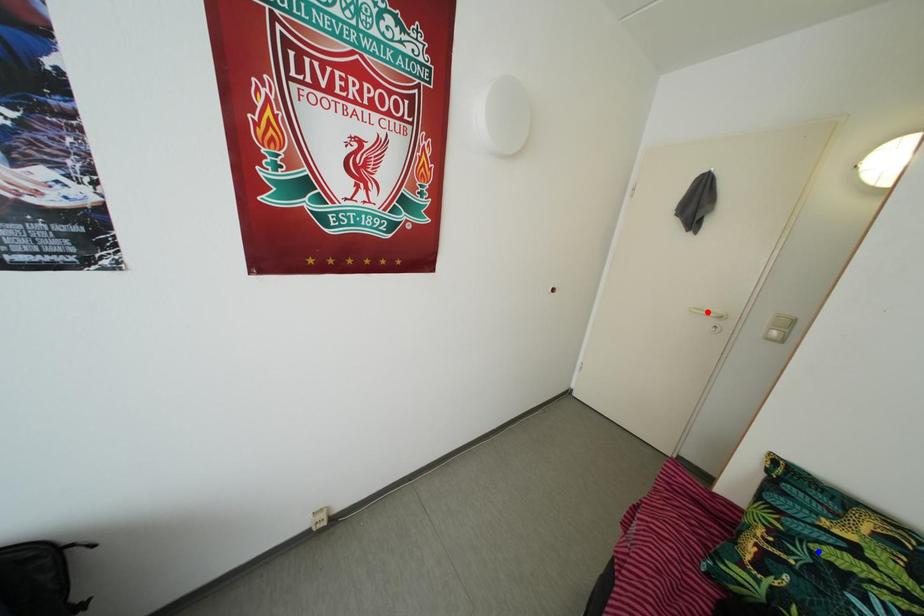
Question: In the image, two points are highlighted. Which point is nearer to the camera? Reply with the corresponding letter.

Choices:
 (A) blue point
 (B) red point

Answer: (A)